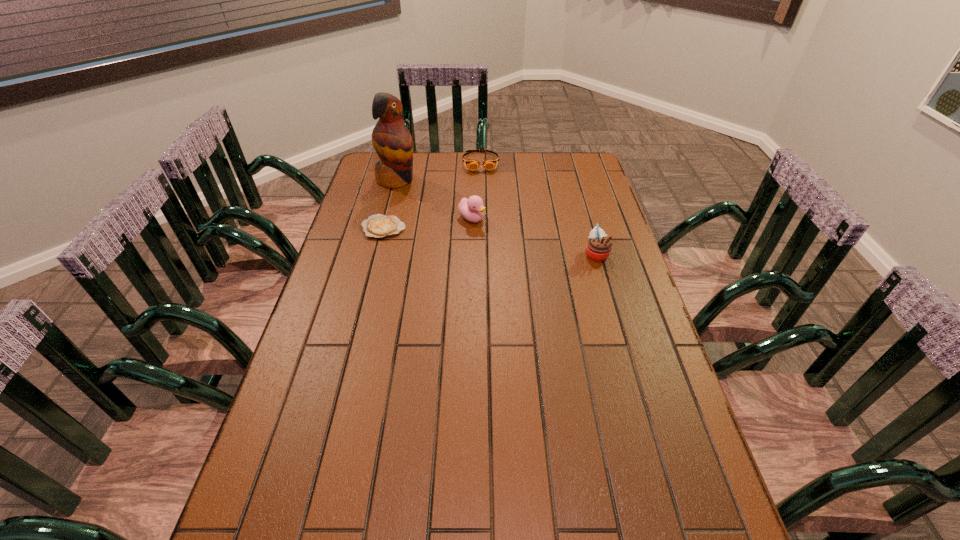
Where is `object positioned at the right edge`? The height and width of the screenshot is (540, 960). object positioned at the right edge is located at coordinates (598, 248).

Locate an element on the screen. Image resolution: width=960 pixels, height=540 pixels. object that is positioned at the far left corner is located at coordinates (392, 141).

Find the location of `vacant space at the far edge of the desktop`. vacant space at the far edge of the desktop is located at coordinates (444, 165).

The image size is (960, 540). Identify the location of free space at the near edge of the desktop. (594, 508).

The image size is (960, 540). In order to click on vacant space at the left edge of the desktop in this screenshot , I will do `click(363, 340)`.

This screenshot has width=960, height=540. Identify the location of blank space at the right edge. (579, 208).

Identify the location of free space at the far right corner of the desktop. The image size is (960, 540). (569, 154).

Where is `vacant space in between the parrot and the goggles`? vacant space in between the parrot and the goggles is located at coordinates (439, 171).

Where is `free area in between the tallest object and the duckling`? free area in between the tallest object and the duckling is located at coordinates (434, 199).

Where is `vacant area that lies between the rightmost object and the second shortest object`? This screenshot has width=960, height=540. vacant area that lies between the rightmost object and the second shortest object is located at coordinates (539, 208).